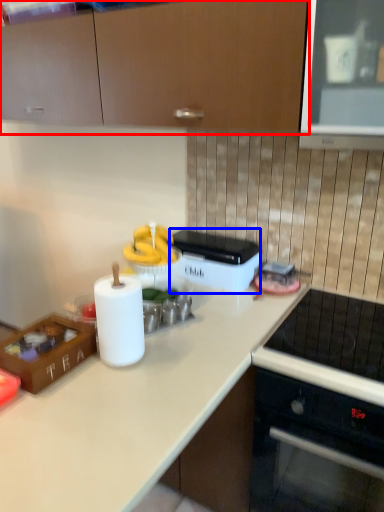
Question: Which point is closer to the camera, cabinetry (highlighted by a red box) or appliance (highlighted by a blue box)?

Choices:
 (A) cabinetry
 (B) appliance

Answer: (A)